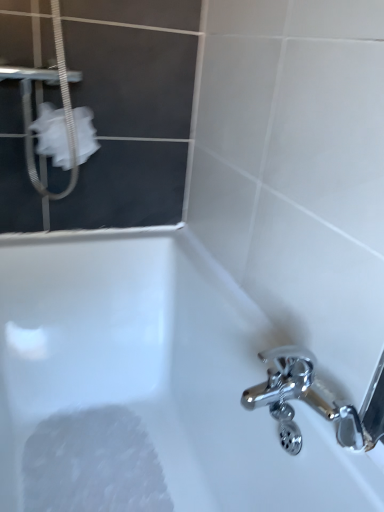
Question: Visually, is white foamy at bottom left positioned to the left or to the right of white fabric screen door at upper left?

Choices:
 (A) right
 (B) left

Answer: (A)

Question: From the image's perspective, relative to white fabric screen door at upper left, is white foamy at bottom left above or below?

Choices:
 (A) above
 (B) below

Answer: (B)

Question: Which is nearer to the white fabric screen door at upper left?

Choices:
 (A) white fabric at upper left
 (B) white foamy at bottom left
 (C) white glossy bathtub at lower left

Answer: (A)

Question: Estimate the real-world distances between objects in this image. Which object is closer to the white glossy bathtub at lower left?

Choices:
 (A) white foamy at bottom left
 (B) white fabric at upper left
 (C) white fabric screen door at upper left

Answer: (A)